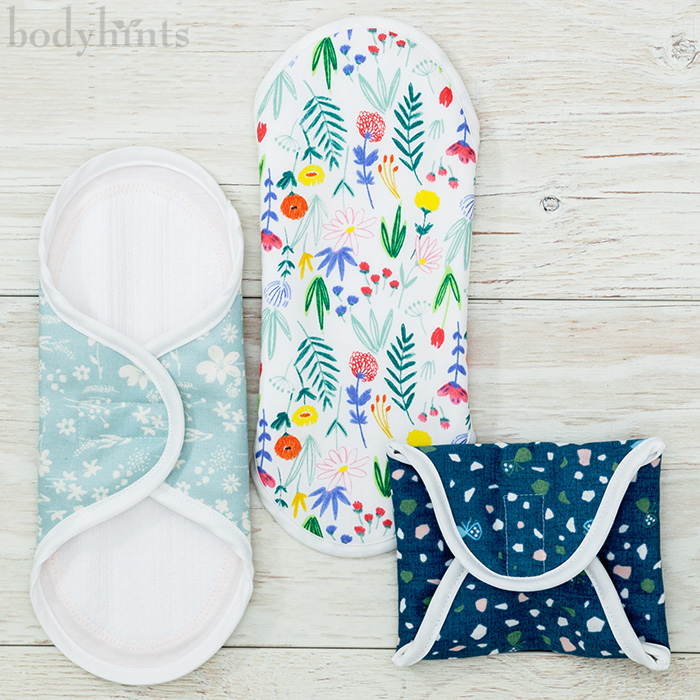
Where is `floral fabric`? Image resolution: width=700 pixels, height=700 pixels. floral fabric is located at coordinates (354, 280), (477, 490), (78, 409).